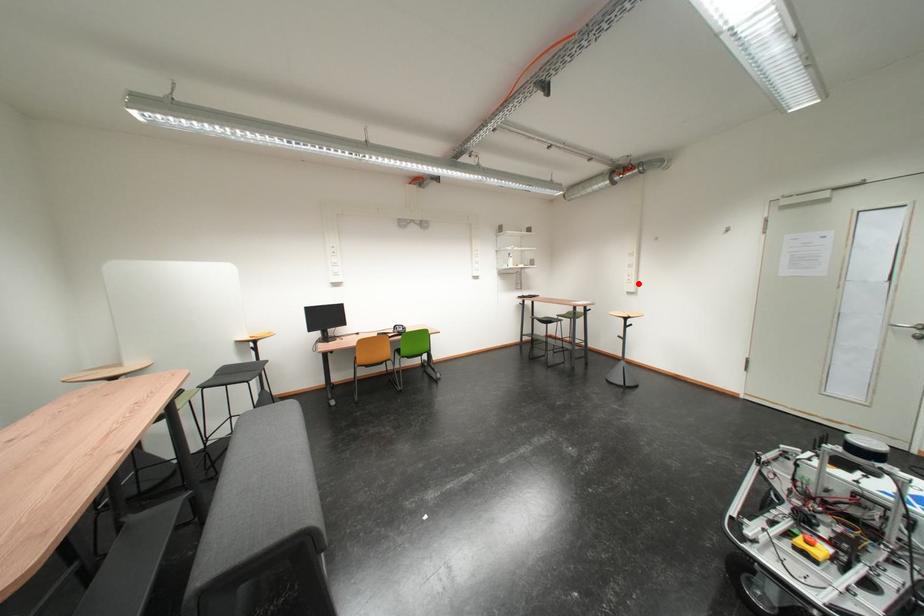
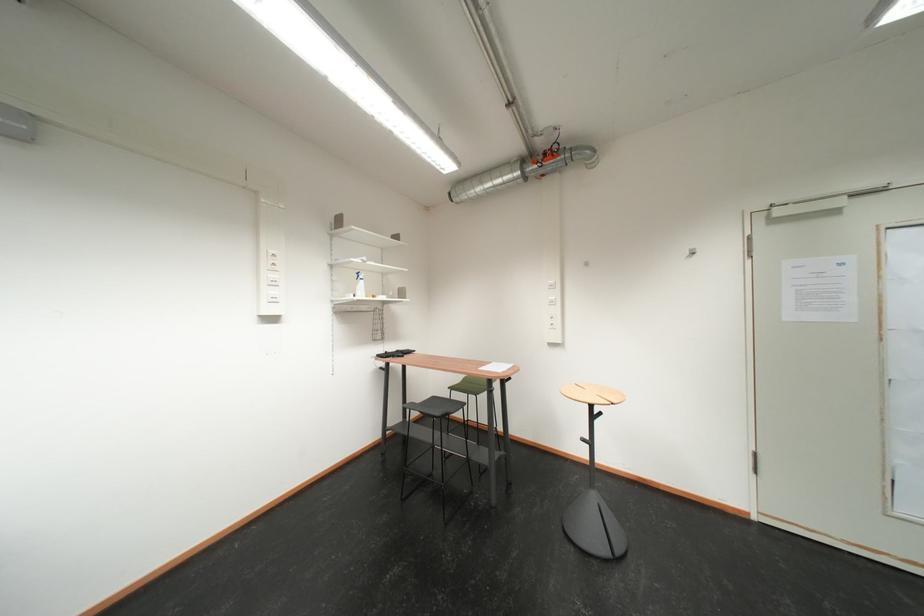
Question: I am providing you with two images of the same scene from different viewpoints. A red point is shown in image1. For the corresponding object point in image2, is it positioned nearer or farther from the camera?

Choices:
 (A) Nearer
 (B) Farther

Answer: (B)